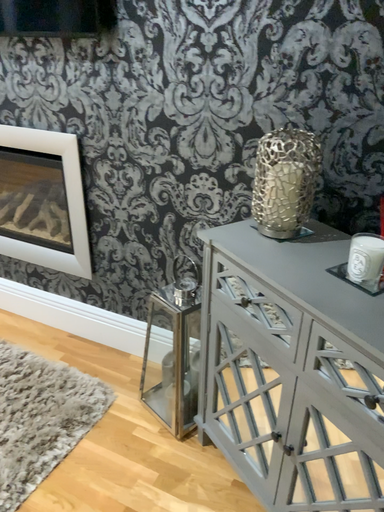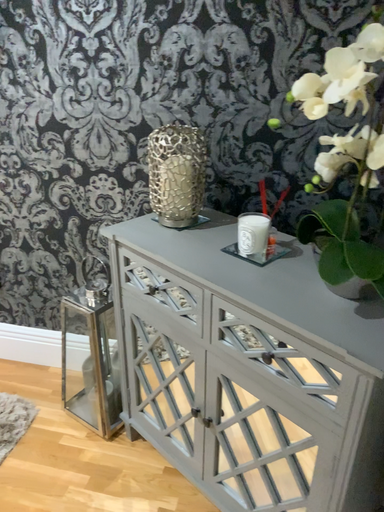
Question: Which way did the camera rotate in the video?

Choices:
 (A) rotated right
 (B) rotated left

Answer: (A)